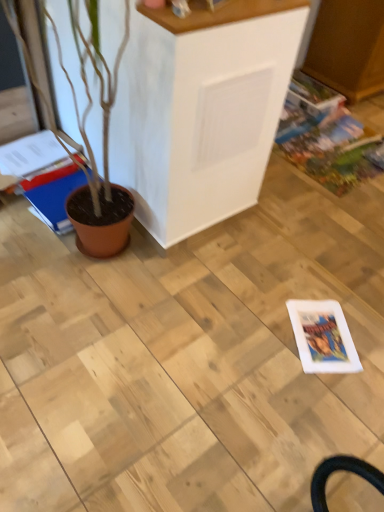
Question: Is matte brown magazine at left, which is counted as the 1th magazine, starting from the right, taller or shorter than multicolored glossy comic book at right?

Choices:
 (A) short
 (B) tall

Answer: (B)

Question: Based on their sizes in the image, would you say matte brown magazine at left, which is the 2th magazine from left to right, is bigger or smaller than multicolored glossy comic book at right?

Choices:
 (A) big
 (B) small

Answer: (B)

Question: Which is farther from the white matte cabinet at center?

Choices:
 (A) blue glossy magazine at left, positioned as the first magazine in left-to-right order
 (B) matte brown magazine at left, which is counted as the 1th magazine, starting from the right
 (C) multicolored glossy comic book at right

Answer: (C)

Question: Estimate the real-world distances between objects in this image. Which object is farther from the multicolored glossy comic book at right?

Choices:
 (A) white matte cabinet at center
 (B) blue glossy magazine at left, the 2th magazine from the right
 (C) matte brown magazine at left, which is the 2th magazine from left to right

Answer: (C)